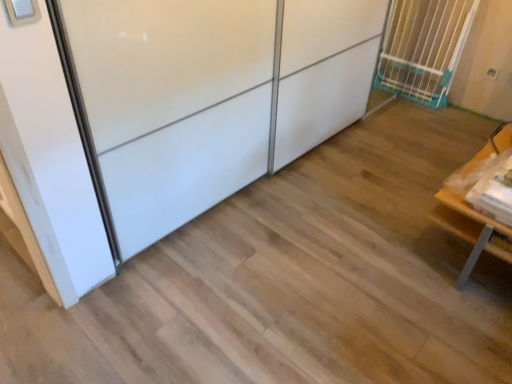
Locate an element on the screen. The height and width of the screenshot is (384, 512). white glossy sliding door at upper left is located at coordinates (173, 104).

What is the approximate height of white plastic gate at upper right?

It is 31.75 inches.

What do you see at coordinates (470, 229) in the screenshot?
I see `wooden table at right` at bounding box center [470, 229].

You are a GUI agent. You are given a task and a screenshot of the screen. Output one action in this format:
    pyautogui.click(x=<x>, y=<y>)
    Task: Click on the white glossy sliding door at upper left
    The height and width of the screenshot is (384, 512).
    Given the screenshot: What is the action you would take?
    pyautogui.click(x=173, y=104)

Consider the image. Considering the sizes of objects wooden table at right and white glossy sliding door at upper left in the image provided, who is taller, wooden table at right or white glossy sliding door at upper left?

With more height is white glossy sliding door at upper left.

Is wooden table at right bigger or smaller than white glossy sliding door at upper left?

Clearly, wooden table at right is smaller in size than white glossy sliding door at upper left.

Is wooden table at right to the left of white glossy sliding door at upper left from the viewer's perspective?

Incorrect, wooden table at right is not on the left side of white glossy sliding door at upper left.

From the image's perspective, which object appears higher, wooden table at right or white glossy sliding door at upper left?

white glossy sliding door at upper left, from the image's perspective.

From the image's perspective, which is below, white glossy sliding door at upper left or white plastic gate at upper right?

white glossy sliding door at upper left.

Are white glossy sliding door at upper left and white plastic gate at upper right making contact?

No, white glossy sliding door at upper left is not touching white plastic gate at upper right.

Is white glossy sliding door at upper left in front of or behind white plastic gate at upper right in the image?

Clearly, white glossy sliding door at upper left is in front of white plastic gate at upper right.

Based on their positions, is white glossy sliding door at upper left located to the left or right of white plastic gate at upper right?

In the image, white glossy sliding door at upper left appears on the left side of white plastic gate at upper right.

Can you confirm if white glossy sliding door at upper left is positioned to the right of wooden table at right?

No.

Is white glossy sliding door at upper left oriented towards wooden table at right?

Yes, white glossy sliding door at upper left is turned towards wooden table at right.

From a real-world perspective, who is located higher, white plastic gate at upper right or white glossy sliding door at upper left?

white glossy sliding door at upper left.

How different are the orientations of white plastic gate at upper right and white glossy sliding door at upper left in degrees?

The facing directions of white plastic gate at upper right and white glossy sliding door at upper left are 88.7 degrees apart.

From the image's perspective, which is above, white plastic gate at upper right or white glossy sliding door at upper left?

white plastic gate at upper right, from the image's perspective.

Considering the relative sizes of white plastic gate at upper right and white glossy sliding door at upper left in the image provided, is white plastic gate at upper right thinner than white glossy sliding door at upper left?

Yes.

The height and width of the screenshot is (384, 512). Identify the location of cage behind the wooden table at right. (423, 48).

From the image's perspective, is wooden table at right below white plastic gate at upper right?

Yes, from the image's perspective, wooden table at right is below white plastic gate at upper right.

From a real-world perspective, who is located higher, wooden table at right or white plastic gate at upper right?

white plastic gate at upper right, from a real-world perspective.

What's the angular difference between wooden table at right and white plastic gate at upper right's facing directions?

There is a 91.8-degree angle between the facing directions of wooden table at right and white plastic gate at upper right.

Considering the sizes of objects white plastic gate at upper right and wooden table at right in the image provided, who is bigger, white plastic gate at upper right or wooden table at right?

With larger size is wooden table at right.

Is white plastic gate at upper right next to wooden table at right and touching it?

white plastic gate at upper right is not next to wooden table at right, and they're not touching.

Is white plastic gate at upper right turned away from wooden table at right?

No, white plastic gate at upper right's orientation is not away from wooden table at right.

Image resolution: width=512 pixels, height=384 pixels. I want to click on screen door in front of the wooden table at right, so click(x=173, y=104).

What are the coordinates of `cage that is under the white glossy sliding door at upper left (from a real-world perspective)` in the screenshot? It's located at (x=423, y=48).

From the image, which object appears to be nearer to wooden table at right, white glossy sliding door at upper left or white plastic gate at upper right?

white glossy sliding door at upper left is closer to wooden table at right.

Estimate the real-world distances between objects in this image. Which object is further from white glossy sliding door at upper left, white plastic gate at upper right or wooden table at right?

white plastic gate at upper right.

From the picture: Looking at the image, which one is located further to white glossy sliding door at upper left, wooden table at right or white plastic gate at upper right?

Among the two, white plastic gate at upper right is located further to white glossy sliding door at upper left.

Considering their positions, is white plastic gate at upper right positioned closer to wooden table at right than white glossy sliding door at upper left?

white glossy sliding door at upper left is positioned closer to the anchor wooden table at right.

When comparing their distances from white plastic gate at upper right, does white glossy sliding door at upper left or wooden table at right seem closer?

Among the two, wooden table at right is located nearer to white plastic gate at upper right.

Which object lies further to the anchor point white plastic gate at upper right, wooden table at right or white glossy sliding door at upper left?

white glossy sliding door at upper left lies further to white plastic gate at upper right than the other object.

In order to click on furniture between white glossy sliding door at upper left and white plastic gate at upper right along the z-axis in this screenshot , I will do `click(470, 229)`.